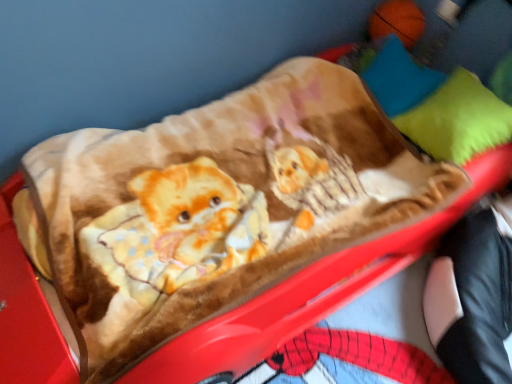
Question: Based on their positions, is black leather pants at lower right located to the left or right of blue soft pillow at upper right, the 2th pillow ordered from the bottom?

Choices:
 (A) left
 (B) right

Answer: (B)

Question: In the image, is black leather pants at lower right positioned in front of or behind blue soft pillow at upper right, the 2th pillow ordered from the bottom?

Choices:
 (A) behind
 (B) front

Answer: (B)

Question: Considering the real-world distances, which object is closest to the blue soft pillow at upper right, the 2th pillow ordered from the bottom?

Choices:
 (A) green soft pillow at upper right, arranged as the second pillow when viewed from the top
 (B) black leather pants at lower right

Answer: (A)

Question: Which object is positioned closest to the green soft pillow at upper right, arranged as the second pillow when viewed from the top?

Choices:
 (A) blue soft pillow at upper right, the 1th pillow when ordered from top to bottom
 (B) black leather pants at lower right

Answer: (A)